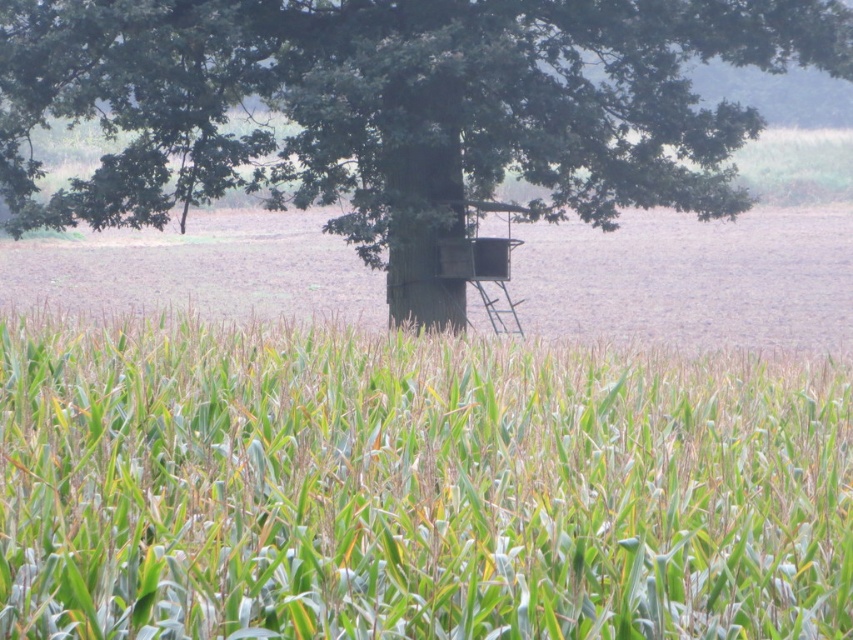
You are a farmer planning to plant a new row of corn between the green matte corn field at center and the green wood tree at center. Based on their current thickness, which object would require more space to accommodate the new row?

The green wood tree at center requires more space because the green matte corn field at center is thinner than it.

You are a farmer planning to plant a new row of corn between the green matte corn field at center and the green wood tree at center. Based on their sizes, which area should you prioritize for expansion to ensure the new row has enough space?

The green wood tree at center has a larger size compared to the green matte corn field at center, so you should prioritize expanding the area near the green wood tree at center to accommodate the new row of corn.